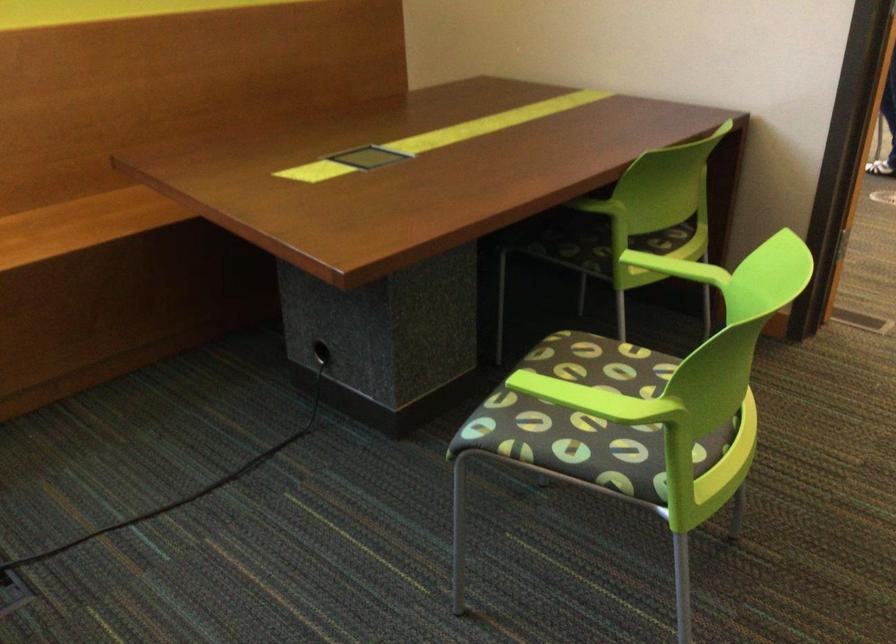
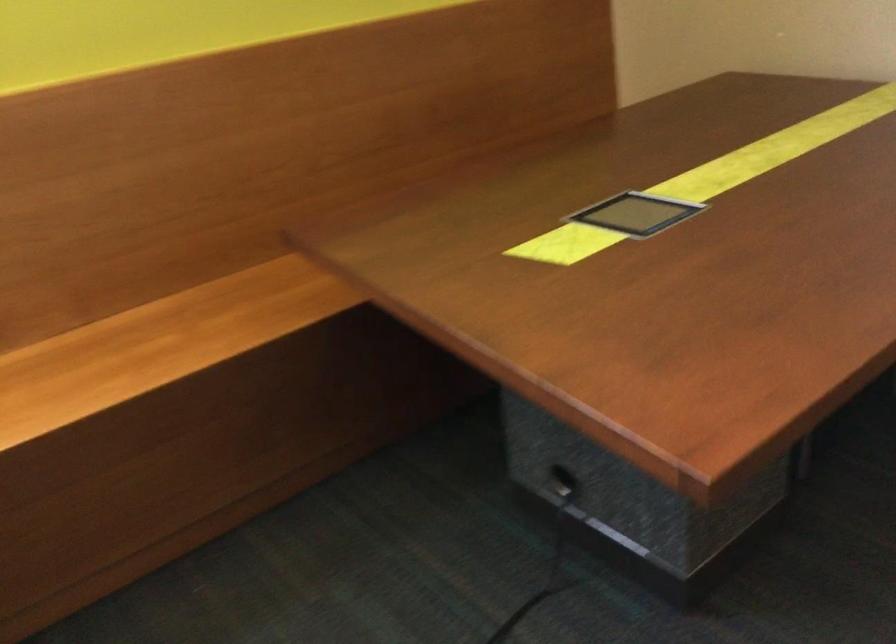
Question: How did the camera likely rotate?

Choices:
 (A) Left
 (B) Right
 (C) Up
 (D) Down

Answer: (A)